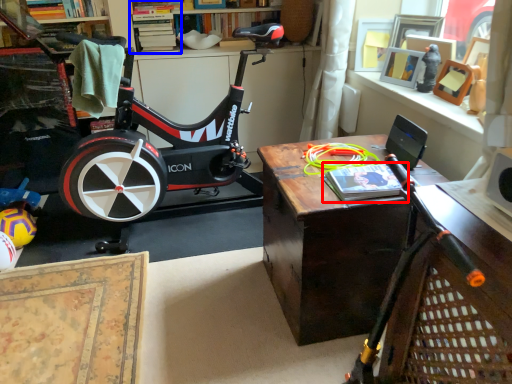
Question: Among these objects, which one is farthest to the camera, book (highlighted by a red box) or shelf (highlighted by a blue box)?

Choices:
 (A) book
 (B) shelf

Answer: (B)